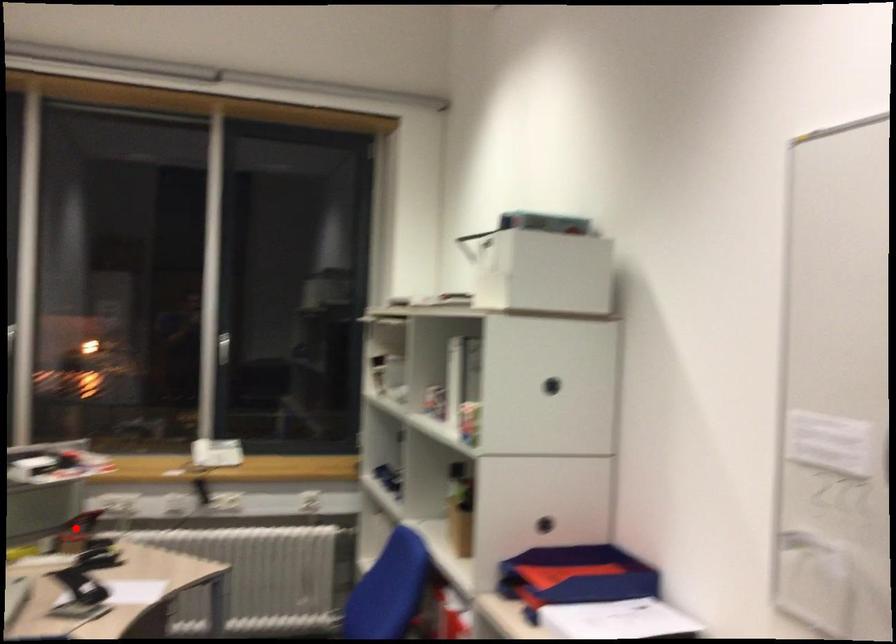
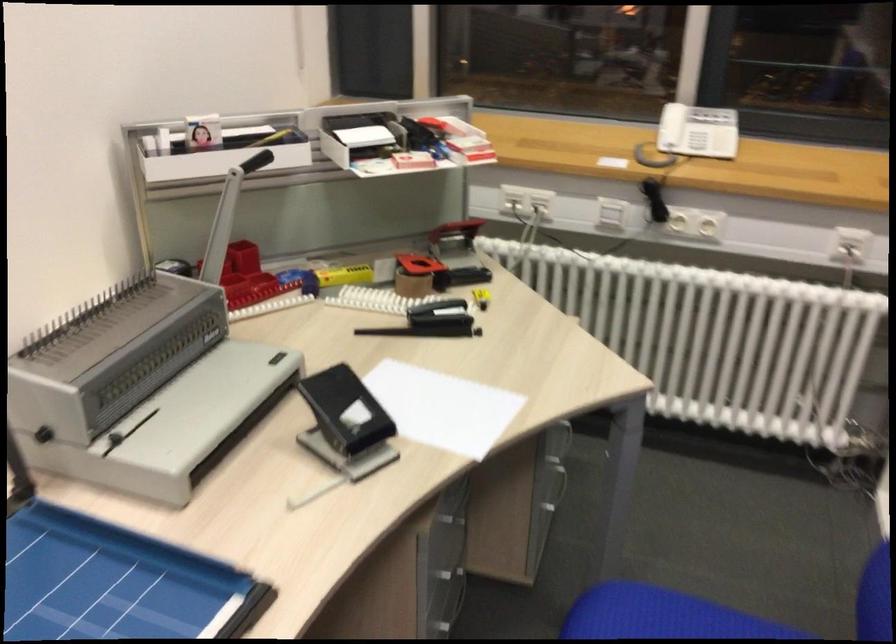
Question: I am providing you with two images of the same scene from different viewpoints. A red point is shown in image1. For the corresponding object point in image2, is it positioned nearer or farther from the camera?

Choices:
 (A) Nearer
 (B) Farther

Answer: (A)